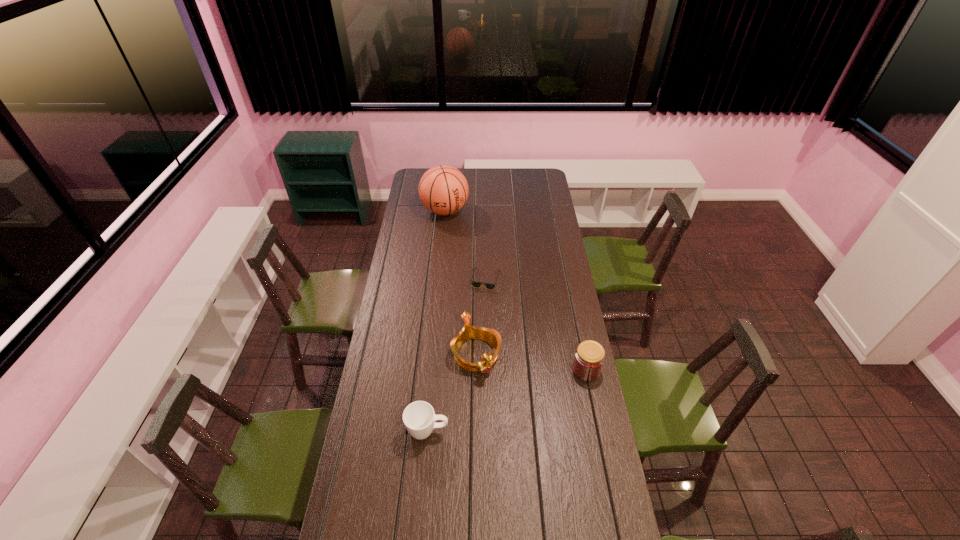
Find the location of a particular element. The width and height of the screenshot is (960, 540). vacant region between the tallest object and the jam is located at coordinates click(x=516, y=291).

You are a GUI agent. You are given a task and a screenshot of the screen. Output one action in this format:
    pyautogui.click(x=<x>, y=<y>)
    Task: Click on the free area in between the rightmost object and the tiara
    Image resolution: width=960 pixels, height=540 pixels.
    Given the screenshot: What is the action you would take?
    pyautogui.click(x=531, y=362)

At what (x,y) coordinates should I click in order to perform the action: click on vacant space that's between the sunglasses and the tallest object. Please return your answer as a coordinate pair (x, y). Looking at the image, I should click on (465, 245).

Identify which object is located as the fourth nearest to the farthest object. Please provide its 2D coordinates. Your answer should be formatted as a tuple, i.e. [(x, y)], where the tuple contains the x and y coordinates of a point satisfying the conditions above.

[(419, 418)]

Locate which object is the fourth closest to the cup. Please provide its 2D coordinates. Your answer should be formatted as a tuple, i.e. [(x, y)], where the tuple contains the x and y coordinates of a point satisfying the conditions above.

[(443, 190)]

The width and height of the screenshot is (960, 540). Identify the location of vacant position in the image that satisfies the following two spatial constraints: 1. on the back side of the shortest object; 2. on the left side of the tiara. (476, 279).

I want to click on free space that satisfies the following two spatial constraints: 1. on the front side of the tiara; 2. on the right side of the rightmost object, so click(476, 370).